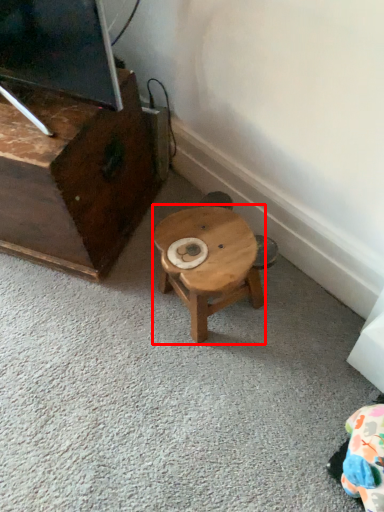
Question: From the image, what is the correct spatial relationship of stool (annotated by the red box) in relation to furniture?

Choices:
 (A) left
 (B) right

Answer: (B)